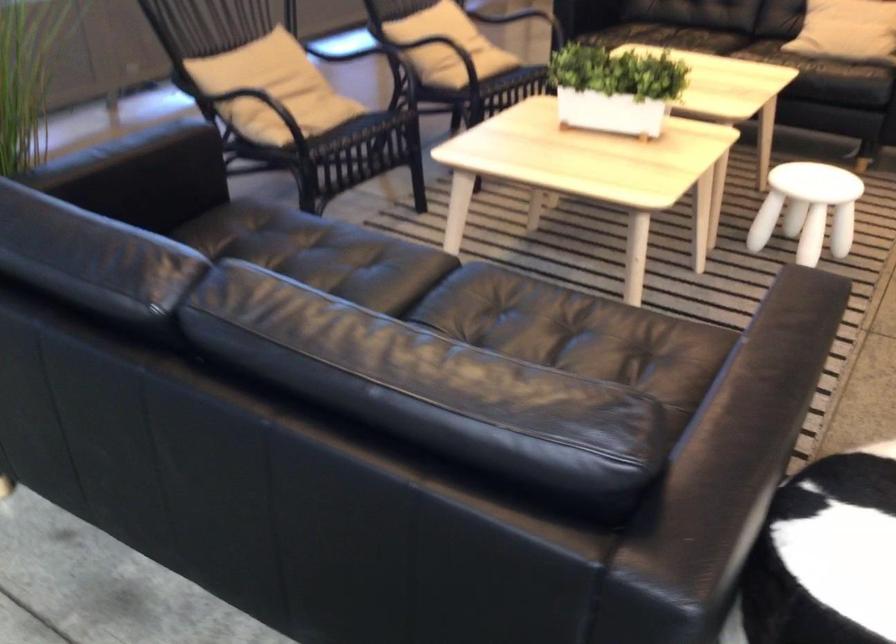
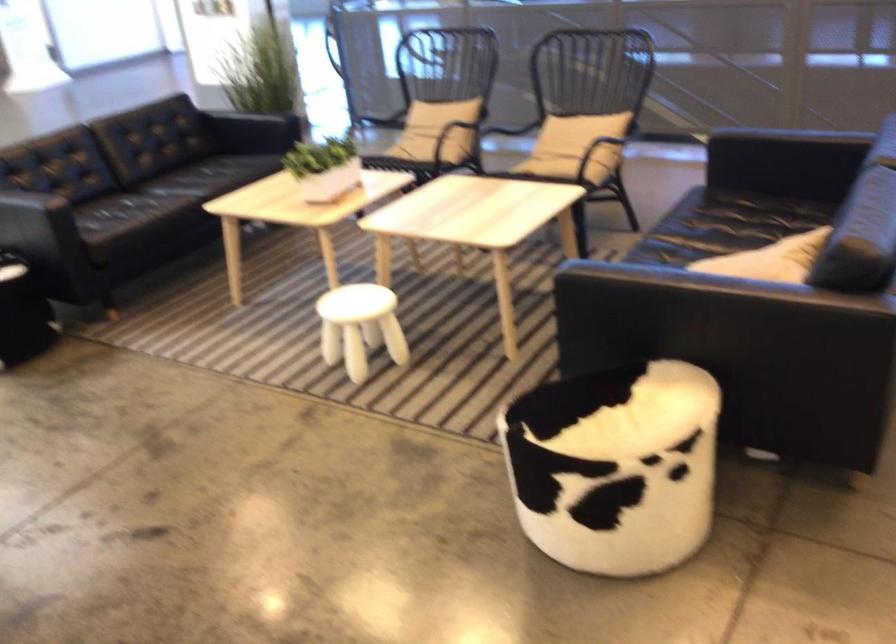
In the second image, find the point that corresponds to the point at 337,90 in the first image.

(450, 135)